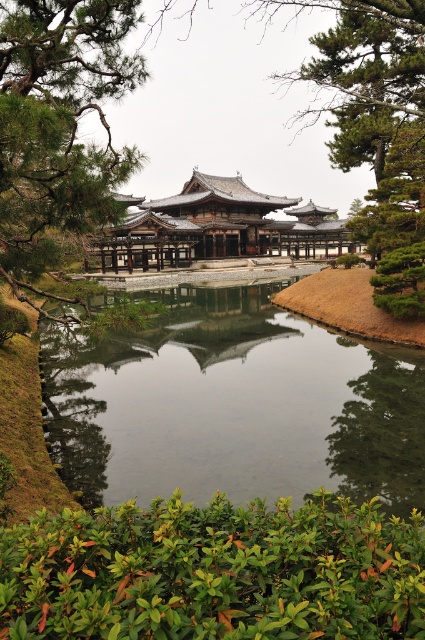
Question: Considering the real-world distances, which object is farthest from the green textured pine tree at upper left?

Choices:
 (A) clear water at center
 (B) matte wooden pagoda at center
 (C) green leafy bush at lower center

Answer: (B)

Question: Which point is farther to the camera?

Choices:
 (A) clear water at center
 (B) green leafy bush at lower center

Answer: (A)

Question: Which of these objects is positioned farthest from the matte wooden pagoda at center?

Choices:
 (A) green leafy bush at lower center
 (B) clear water at center
 (C) green textured pine tree at upper left

Answer: (C)

Question: Does green textured pine tree at upper left have a lesser width compared to matte wooden pagoda at center?

Choices:
 (A) yes
 (B) no

Answer: (A)

Question: Is clear water at center closer to camera compared to green textured pine tree at upper left?

Choices:
 (A) yes
 (B) no

Answer: (A)

Question: Does green textured pine tree at upper left appear on the right side of matte wooden pagoda at center?

Choices:
 (A) no
 (B) yes

Answer: (A)